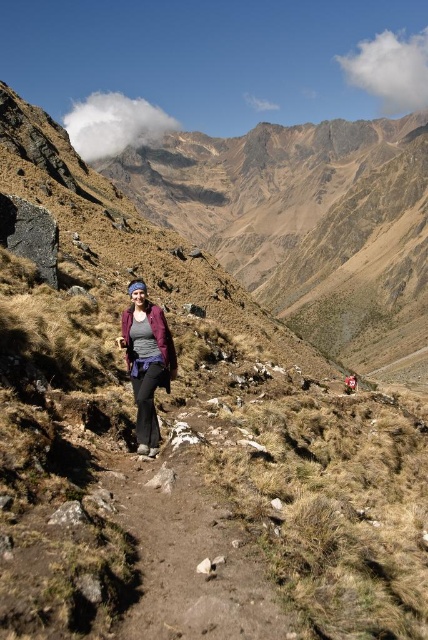
You are the hiker in the image and need to step forward. Which direction should you move your foot to step onto the dirt path at center without stepping on the matte purple jacket at center?

The dirt path at center is in front of the matte purple jacket at center, so you should step forward in the direction of the dirt path at center to avoid stepping on the matte purple jacket at center.

You are a hiker planning to walk along the dirt path at center while wearing your matte purple jacket at center. Considering the path width, will your jacket interfere with your movement?

The dirt path at center is wider than the matte purple jacket at center, so the jacket will not interfere with your movement along the path.

You are a hiker planning to walk along the trail. You see the dirt path at center and the matte purple jacket at center. Which object is closer to you?

The dirt path at center is shorter than matte purple jacket at center, so the dirt path at center is closer to you.